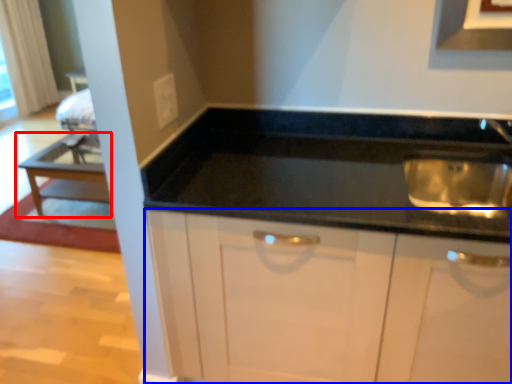
Question: Which point is further to the camera, table (highlighted by a red box) or cabinetry (highlighted by a blue box)?

Choices:
 (A) table
 (B) cabinetry

Answer: (A)